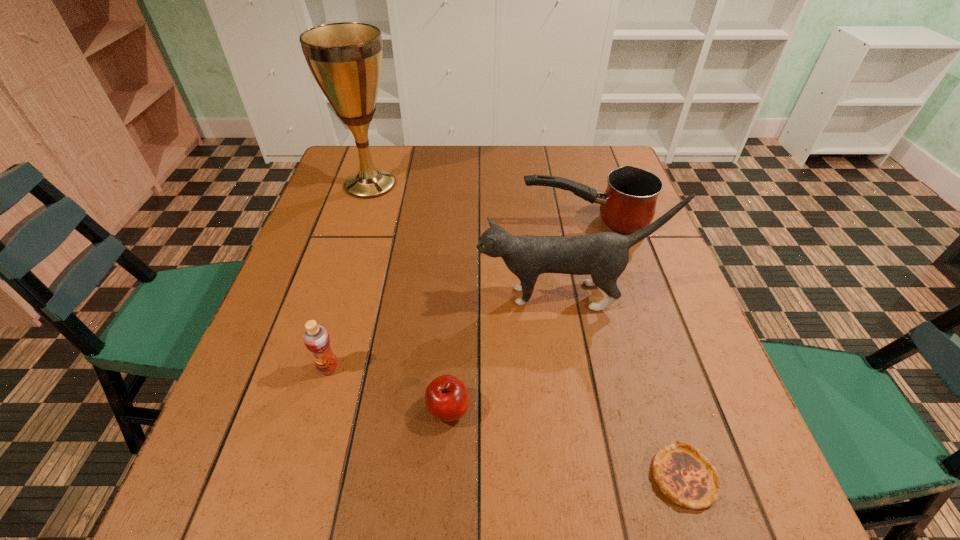
Locate an element on the screen. The height and width of the screenshot is (540, 960). vacant space located on the front of the trophy cup is located at coordinates (354, 235).

Image resolution: width=960 pixels, height=540 pixels. What are the coordinates of `free point located 0.230m at the face of the fourth nearest object` in the screenshot? It's located at (373, 296).

The width and height of the screenshot is (960, 540). I want to click on free point located 0.300m at the face of the fourth nearest object, so click(342, 296).

Where is `free space located at the face of the fourth nearest object`? Image resolution: width=960 pixels, height=540 pixels. free space located at the face of the fourth nearest object is located at coordinates (311, 296).

Where is `free location located on the handle side of the saucepan`? Image resolution: width=960 pixels, height=540 pixels. free location located on the handle side of the saucepan is located at coordinates (404, 222).

The image size is (960, 540). I want to click on vacant space located on the handle side of the saucepan, so click(491, 222).

Image resolution: width=960 pixels, height=540 pixels. What are the coordinates of `free space located on the handle side of the saucepan` in the screenshot? It's located at (434, 222).

Locate an element on the screen. Image resolution: width=960 pixels, height=540 pixels. vacant space located 0.260m on the back of the orange juice is located at coordinates (357, 267).

This screenshot has height=540, width=960. What are the coordinates of `vacant space located on the back of the apple` in the screenshot? It's located at (455, 288).

You are a GUI agent. You are given a task and a screenshot of the screen. Output one action in this format:
    pyautogui.click(x=<x>, y=<y>)
    Task: Click on the vacant space located 0.280m on the back of the shortest object
    The image size is (960, 540).
    Given the screenshot: What is the action you would take?
    pyautogui.click(x=634, y=318)